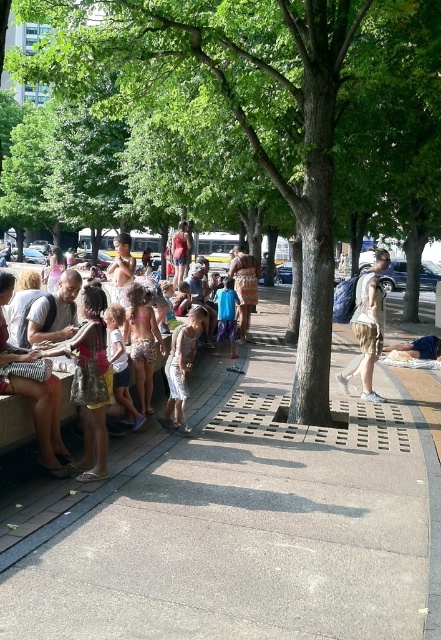
Who is positioned more to the right, white cotton dress at center or matte white shirt at center?

white cotton dress at center

Is white cotton dress at center below matte white shirt at center?

Actually, white cotton dress at center is above matte white shirt at center.

Is point (194, 314) farther from camera compared to point (18, 426)?

Yes, point (194, 314) is behind point (18, 426).

Locate an element on the screen. white cotton dress at center is located at coordinates (180, 365).

What do you see at coordinates (287, 115) in the screenshot?
I see `green leafy tree at center` at bounding box center [287, 115].

Between green leafy tree at center and matte pink dress at center, which one appears on the left side from the viewer's perspective?

matte pink dress at center is more to the left.

Describe the element at coordinates (287, 115) in the screenshot. The width and height of the screenshot is (441, 640). I see `green leafy tree at center` at that location.

Identify the location of green leafy tree at center. The width and height of the screenshot is (441, 640). (287, 115).

Does light brown fabric backpack at center have a greater width compared to matte pink dress at center?

In fact, light brown fabric backpack at center might be narrower than matte pink dress at center.

Between light brown fabric backpack at center and matte pink dress at center, which one appears on the right side from the viewer's perspective?

light brown fabric backpack at center is more to the right.

Identify the location of light brown fabric backpack at center. This screenshot has height=640, width=441. (367, 324).